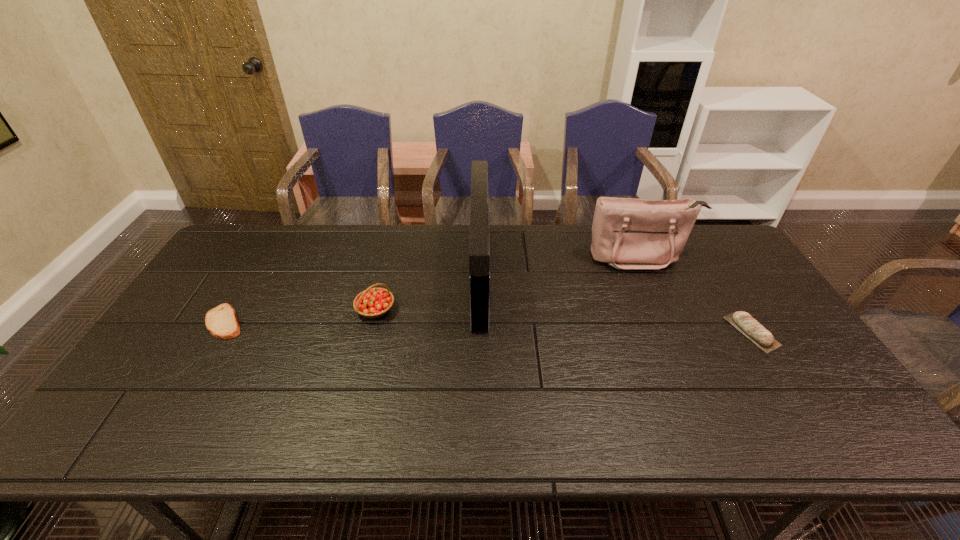
Find the location of a particular element. vacant space that satisfies the following two spatial constraints: 1. on the front pocket of the shoulder bag; 2. on the right side of the taller pita bread is located at coordinates (672, 332).

The image size is (960, 540). Find the location of `free spot that satisfies the following two spatial constraints: 1. on the front pocket of the second tallest object; 2. on the front side of the videotape`. free spot that satisfies the following two spatial constraints: 1. on the front pocket of the second tallest object; 2. on the front side of the videotape is located at coordinates (648, 275).